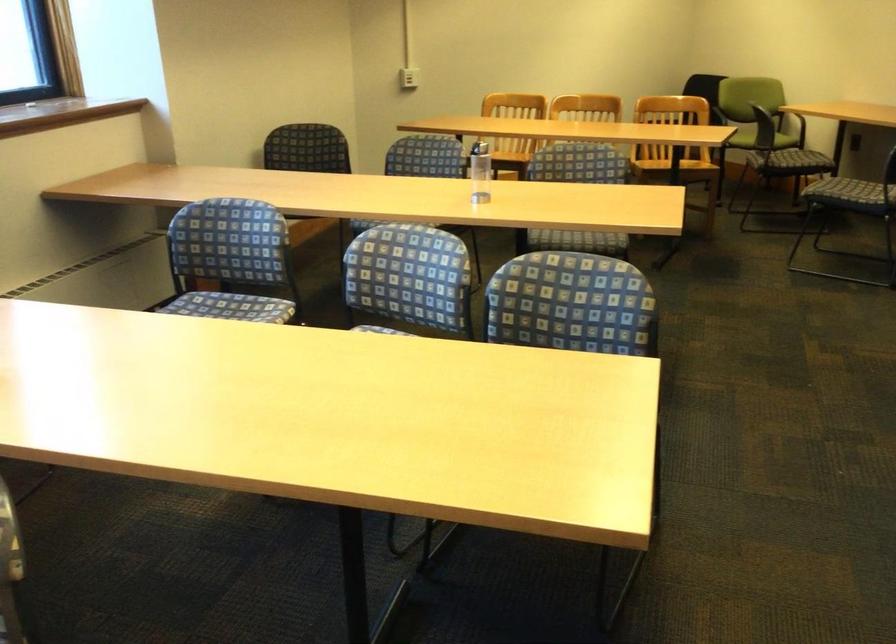
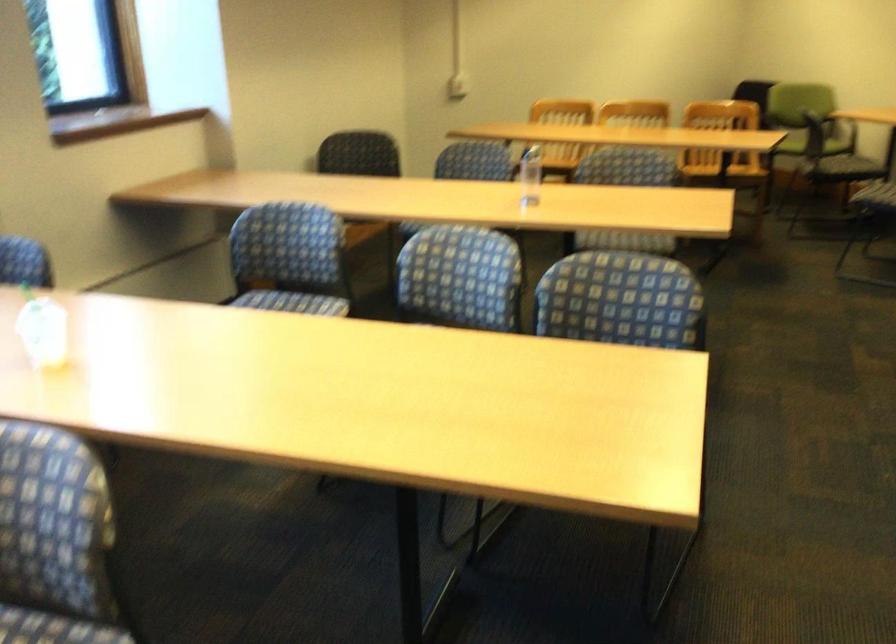
In the second image, find the point that corresponds to (x=230, y=258) in the first image.

(289, 259)